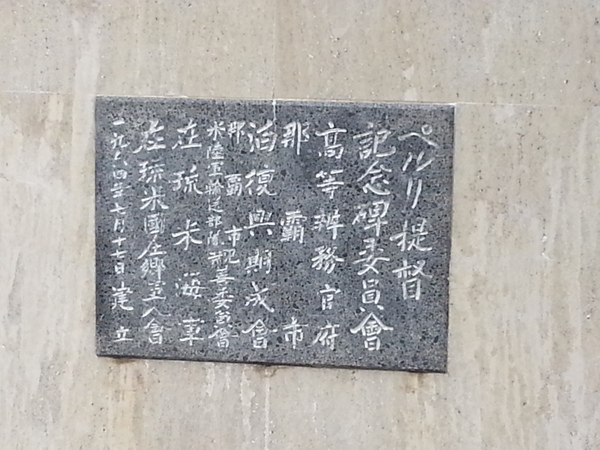
The width and height of the screenshot is (600, 450). In order to click on darker shade on tile in this screenshot , I will do `click(35, 119)`.